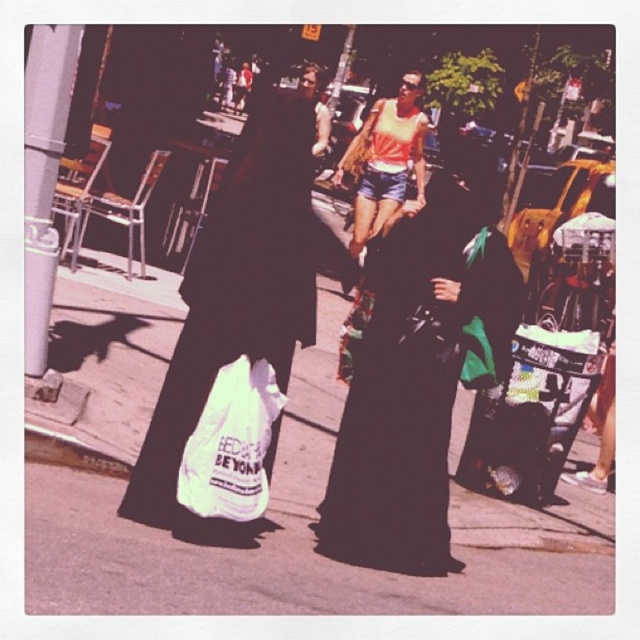
Question: Is white matte plastic bag at center behind white plastic bag at lower center?

Choices:
 (A) no
 (B) yes

Answer: (A)

Question: Based on their relative distances, which object is farther from the white paper bag at center?

Choices:
 (A) white plastic bag at lower center
 (B) black matte abaya at center
 (C) white matte plastic bag at center

Answer: (B)

Question: Is white paper bag at center to the left of black matte abaya at center from the viewer's perspective?

Choices:
 (A) no
 (B) yes

Answer: (B)

Question: Where is black matte abaya at center located in relation to white plastic bag at lower center in the image?

Choices:
 (A) below
 (B) above

Answer: (B)

Question: Which object is the farthest from the white paper bag at center?

Choices:
 (A) white matte plastic bag at center
 (B) black matte abaya at center

Answer: (B)

Question: Which point is closer to the camera?

Choices:
 (A) (412, 593)
 (B) (262, 368)

Answer: (B)